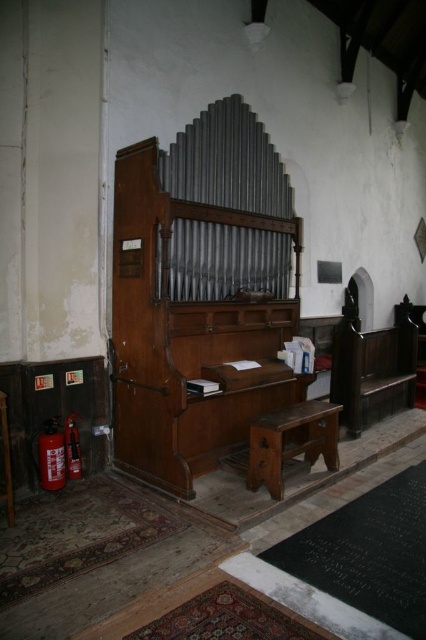
Looking at this image, you are a visitor entering the church and need to locate the red matte extinguisher at lower left. According to the scene, where should you look relative to the brown wooden bench at center?

The brown wooden bench at center is to the right of the red matte extinguisher at lower left, so the red matte extinguisher at lower left is to the left of the brown wooden bench at center. Therefore, you should look to the left side of the brown wooden bench at center to find the red matte extinguisher at lower left.